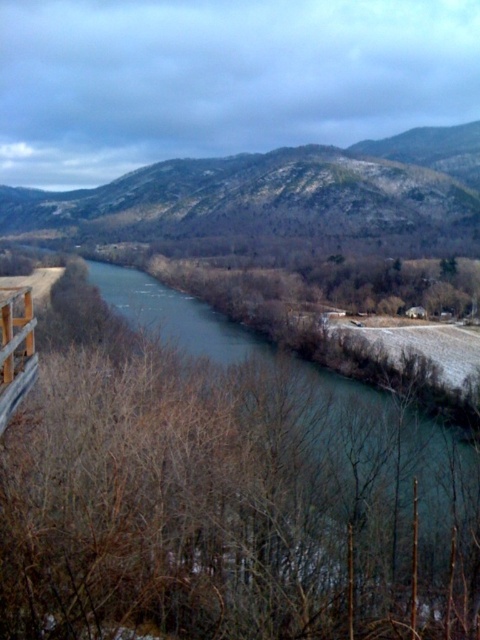
From the picture: You are standing at the wooden structure on the left and want to walk towards the river. There are two points marked in the image, point A at coordinates point (x=80, y=234) and point B at coordinates point (x=110, y=305). Which point is closer to you?

Point B at coordinates point (x=110, y=305) is closer to you because it is in front of point A at coordinates point (x=80, y=234).

You are standing at the wooden structure on the left side of the image. Looking towards the gray rocky mountain at center, in which direction should you walk to reach it? Please state the direction as a compass direction like north, south, etc.

The gray rocky mountain at center is located at point [276,193]. Since you are at the wooden structure on the left side, you should walk towards the right to reach the mountain. In compass terms, this would be eastward direction.